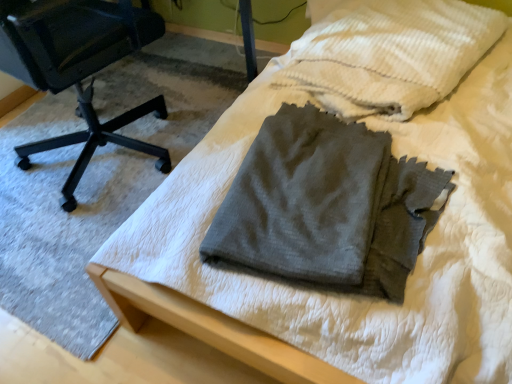
Question: Do you think black plastic chair at left is within gray cotton towel at center, or outside of it?

Choices:
 (A) outside
 (B) inside

Answer: (A)

Question: Looking at the image, does black plastic chair at left seem bigger or smaller compared to gray cotton towel at center?

Choices:
 (A) big
 (B) small

Answer: (A)

Question: Which object is the closest to the gray cotton towel at center?

Choices:
 (A) black plastic chair at left
 (B) dark gray cotton pants at center

Answer: (B)

Question: Which object is positioned closest to the gray cotton towel at center?

Choices:
 (A) black plastic chair at left
 (B) dark gray cotton pants at center

Answer: (B)